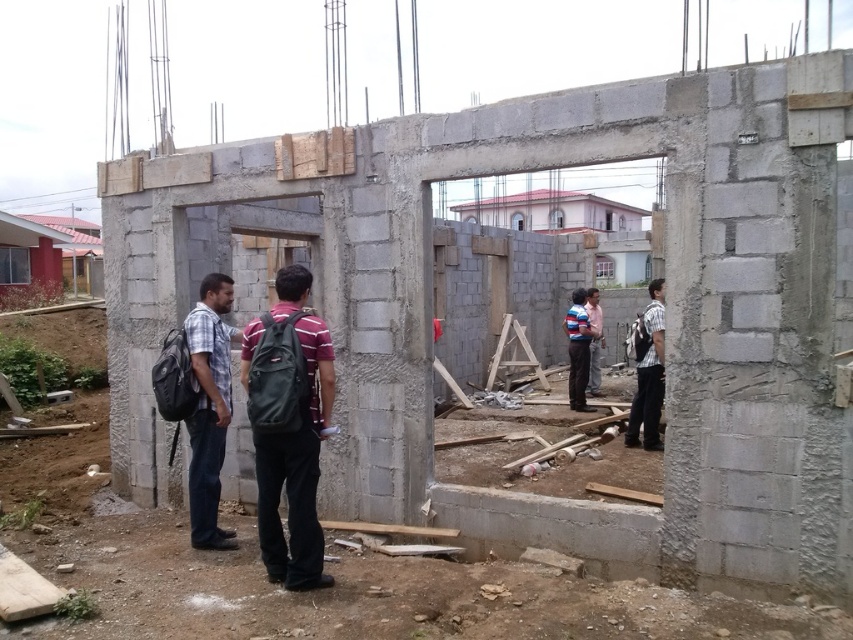
Looking at this image, is dark gray backpack at center in front of striped shirt at center?

Yes.

What do you see at coordinates (289, 426) in the screenshot? Image resolution: width=853 pixels, height=640 pixels. I see `dark gray backpack at center` at bounding box center [289, 426].

Locate an element on the screen. This screenshot has width=853, height=640. dark gray backpack at center is located at coordinates (289, 426).

Does gray concrete foundation at lower center lie in front of striped shirt at center?

Yes, gray concrete foundation at lower center is in front of striped shirt at center.

Can you confirm if gray concrete foundation at lower center is wider than striped shirt at center?

Yes.

What are the coordinates of `gray concrete foundation at lower center` in the screenshot? It's located at (552, 528).

Does plaid shirt at center have a larger size compared to striped shirt at right?

Incorrect, plaid shirt at center is not larger than striped shirt at right.

Between plaid shirt at center and striped shirt at right, which one has less height?

striped shirt at right

Which is in front, point (192, 428) or point (654, 412)?

Point (192, 428) is more forward.

Identify the location of plaid shirt at center. This screenshot has height=640, width=853. (209, 408).